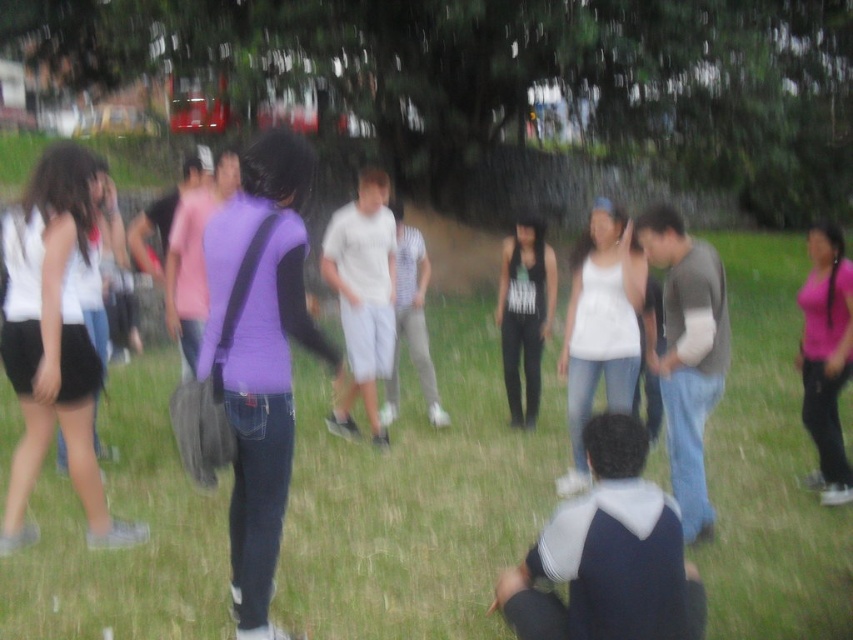
You are a photographer trying to capture a clear shot of the black matte tank top at center and the green grass at center. Considering the scene is slightly blurred due to motion or low shutter speed, can you estimate whether the two objects are close enough to be in focus simultaneously?

The distance between the green grass at center and the black matte tank top at center is 8.58 feet. Since they are separated by this distance, it would be challenging to have both in focus simultaneously due to the shallow depth of field caused by the motion blur or low shutter speed settings.

You are a photographer who wants to capture a clear shot of the black matte tank top at center without the green grass at center showing in the background. Based on the scene description, can you adjust your camera settings to achieve this?

The green grass at center is located below the black matte tank top at center, so adjusting the camera focus to the upper area where the black matte tank top at center is positioned while blurring the lower area with the green grass at center would help achieve the desired result.

In the scene shown: You are organizing a game of tag and need to know the distance between the white matte tank top at center and the pink matte tank top at right. Can you tell me how far apart they are?

The white matte tank top at center is 5.81 feet from the pink matte tank top at right.